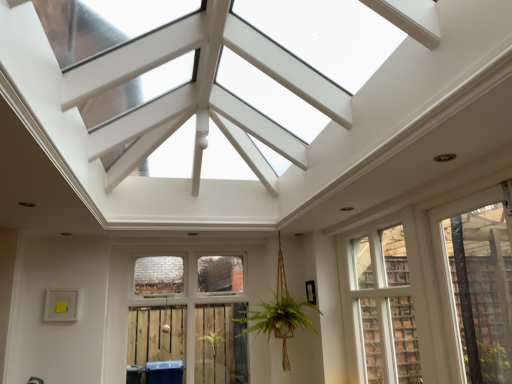
Question: Does white wood window at center, the second window from the right, have a lesser width compared to clear glass window at center, arranged as the first window when viewed from the left?

Choices:
 (A) no
 (B) yes

Answer: (B)

Question: From the image's perspective, is white wood window at center, the second window from the right, beneath clear glass window at center, arranged as the first window when viewed from the left?

Choices:
 (A) yes
 (B) no

Answer: (B)

Question: Is white wood window at center, the second window from the right, at the left side of clear glass window at center, arranged as the first window when viewed from the left?

Choices:
 (A) no
 (B) yes

Answer: (A)

Question: Is white wood window at center, marked as the second window in a left-to-right arrangement, completely or partially outside of clear glass window at center, which appears as the third window when viewed from the right?

Choices:
 (A) yes
 (B) no

Answer: (A)

Question: Is white wood window at center, marked as the second window in a left-to-right arrangement, to the right of clear glass window at center, arranged as the first window when viewed from the left, from the viewer's perspective?

Choices:
 (A) yes
 (B) no

Answer: (A)

Question: From a real-world perspective, does white wood window at center, the second window from the right, sit lower than clear glass window at center, arranged as the first window when viewed from the left?

Choices:
 (A) yes
 (B) no

Answer: (B)

Question: From the image's perspective, is clear glass window at center, which appears as the third window when viewed from the right, under transparent plastic window at right, the first window positioned from the right?

Choices:
 (A) no
 (B) yes

Answer: (B)

Question: From a real-world perspective, is clear glass window at center, arranged as the first window when viewed from the left, below transparent plastic window at right, the first window positioned from the right?

Choices:
 (A) yes
 (B) no

Answer: (A)

Question: Is clear glass window at center, which appears as the third window when viewed from the right, at the left side of transparent plastic window at right, the 3th window positioned from the left?

Choices:
 (A) yes
 (B) no

Answer: (A)

Question: Considering the relative positions of clear glass window at center, which appears as the third window when viewed from the right, and transparent plastic window at right, the first window positioned from the right, in the image provided, is clear glass window at center, which appears as the third window when viewed from the right, in front of transparent plastic window at right, the first window positioned from the right,?

Choices:
 (A) no
 (B) yes

Answer: (A)

Question: From the image's perspective, is clear glass window at center, which appears as the third window when viewed from the right, over transparent plastic window at right, the 3th window positioned from the left?

Choices:
 (A) no
 (B) yes

Answer: (A)

Question: Can you confirm if clear glass window at center, which appears as the third window when viewed from the right, is thinner than transparent plastic window at right, the 3th window positioned from the left?

Choices:
 (A) no
 (B) yes

Answer: (A)

Question: From a real-world perspective, is clear glass window at center, arranged as the first window when viewed from the left, under white wood window at center, marked as the second window in a left-to-right arrangement?

Choices:
 (A) yes
 (B) no

Answer: (A)